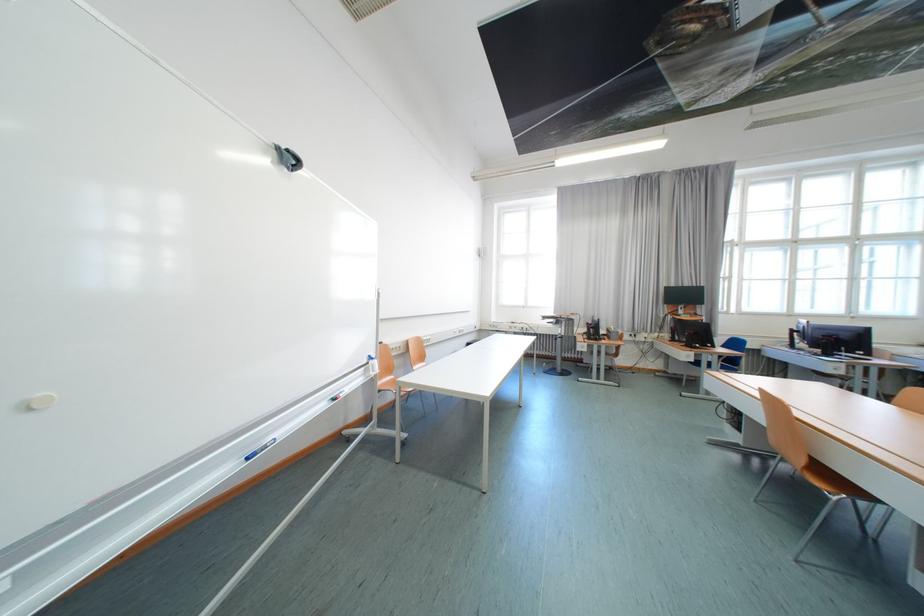
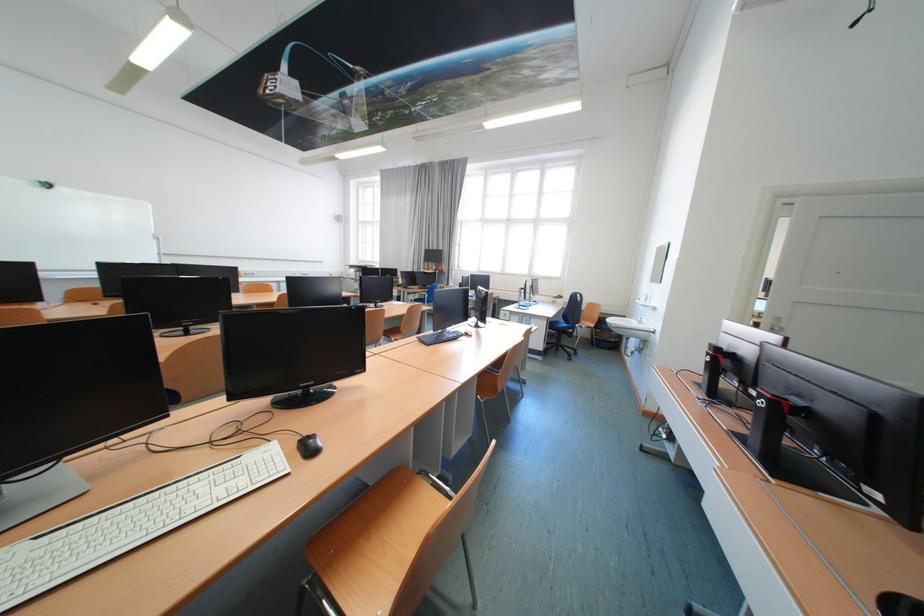
Question: I am providing you with two images of the same scene from different viewpoints. Please identify which objects are invisible in image2.

Choices:
 (A) black computer keyboard
 (B) orange chair sitting surface
 (C) black computer mouse
 (D) pillow handle

Answer: (B)